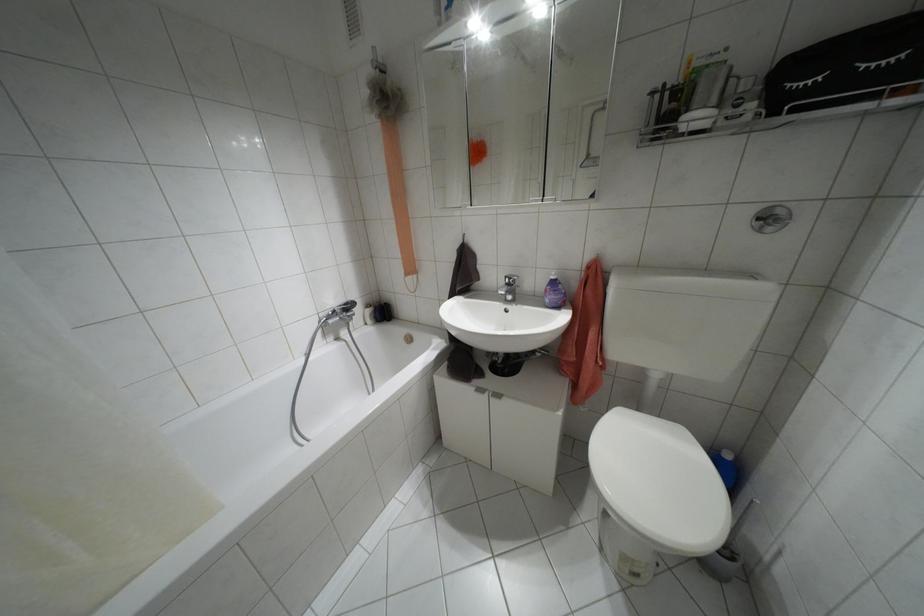
Identify the location of white toilet lid. The height and width of the screenshot is (616, 924). (659, 482).